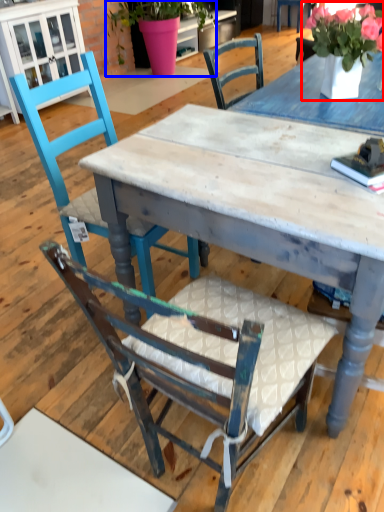
Question: Which of the following is the closest to the observer, floral arrangement (highlighted by a red box) or houseplant (highlighted by a blue box)?

Choices:
 (A) floral arrangement
 (B) houseplant

Answer: (A)